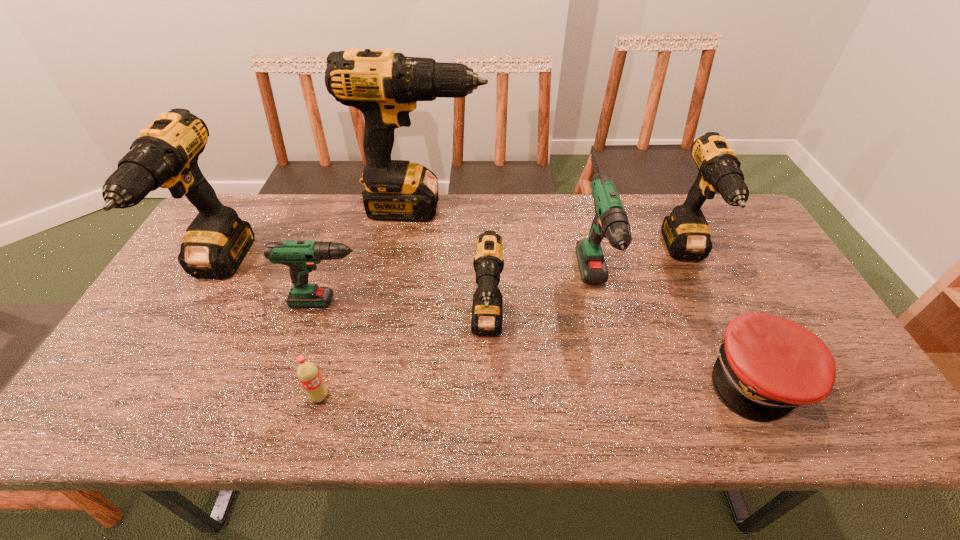
This screenshot has height=540, width=960. I want to click on the farthest object, so click(x=385, y=86).

Locate an element on the screen. the farthest black drill is located at coordinates (385, 86).

Locate an element on the screen. the second tallest drill is located at coordinates (165, 155).

Where is `the leftmost object`? the leftmost object is located at coordinates (165, 155).

In order to click on the rightmost black drill in this screenshot , I will do `click(686, 233)`.

Identify the location of the rightmost drill. (686, 233).

Where is `the second drill from right to left`? the second drill from right to left is located at coordinates (610, 221).

This screenshot has width=960, height=540. What are the coordinates of `the bigger green drill` in the screenshot? It's located at (610, 221).

Locate an element on the screen. the smallest black drill is located at coordinates (487, 309).

Where is `the smaller green drill`? This screenshot has height=540, width=960. the smaller green drill is located at coordinates (300, 256).